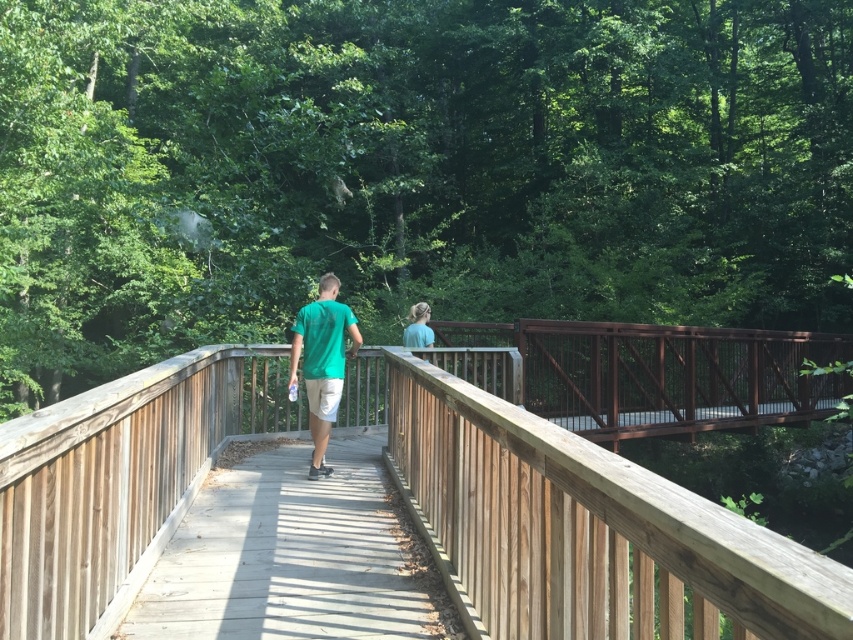
You are standing on the bridge and see the stained wood bridge at center and the light blue shirt at center. Which object is located to the right side?

The stained wood bridge at center is positioned on the right side of light blue shirt at center.

You are standing on the wooden walkway bridge and want to place a small potted plant exactly at the center of the wooden railing at center. According to the image, where should you place the potted plant?

The wooden railing at center is located at the 2D coordinates point (575,518), so you should place the small potted plant at that exact point.